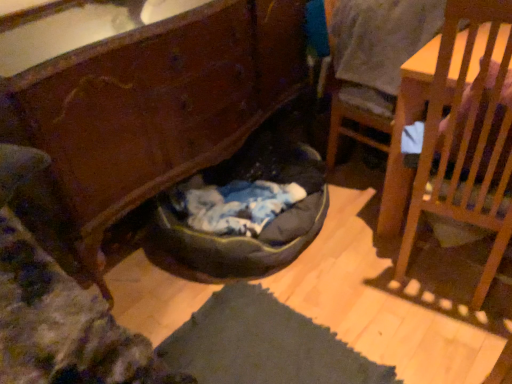
Question: Is dark gray fabric bean bag at lower center taller or shorter than wooden cabinet at lower center?

Choices:
 (A) tall
 (B) short

Answer: (B)

Question: From a real-world perspective, relative to wooden cabinet at lower center, is dark gray fabric bean bag at lower center vertically above or below?

Choices:
 (A) above
 (B) below

Answer: (B)

Question: Which of these objects is positioned closest to the white cotton shirt at upper right?

Choices:
 (A) wooden chair at right, the first chair in the right-to-left sequence
 (B) wooden chair at right, placed as the first chair when sorted from left to right
 (C) dark gray fabric bean bag at lower center
 (D) wooden cabinet at lower center

Answer: (B)

Question: Considering the real-world distances, which object is farthest from the wooden chair at right, placed as the second chair when sorted from left to right?

Choices:
 (A) dark gray fabric bean bag at lower center
 (B) wooden cabinet at lower center
 (C) white cotton shirt at upper right
 (D) wooden chair at right, placed as the first chair when sorted from left to right

Answer: (B)